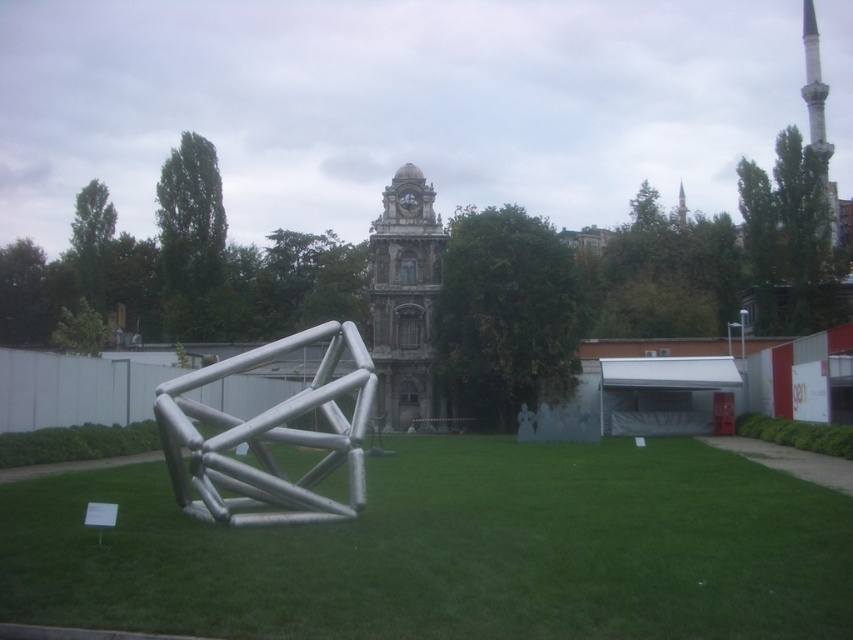
Question: Is green grass at center smaller than stone clock tower at center?

Choices:
 (A) no
 (B) yes

Answer: (A)

Question: Which point is closer to the camera taking this photo?

Choices:
 (A) (813, 92)
 (B) (340, 385)

Answer: (B)

Question: Does green grass at center have a lesser width compared to silver metallic structure at center?

Choices:
 (A) no
 (B) yes

Answer: (A)

Question: Which object is closer to the camera taking this photo?

Choices:
 (A) silver metallic structure at center
 (B) white marble minaret at upper right
 (C) green grass at center

Answer: (C)

Question: Can you confirm if stone clock tower at center is thinner than white marble minaret at upper right?

Choices:
 (A) no
 (B) yes

Answer: (B)

Question: Which is farther from the silver metallic structure at center?

Choices:
 (A) stone clock tower at center
 (B) green grass at center
 (C) white marble minaret at upper right

Answer: (C)